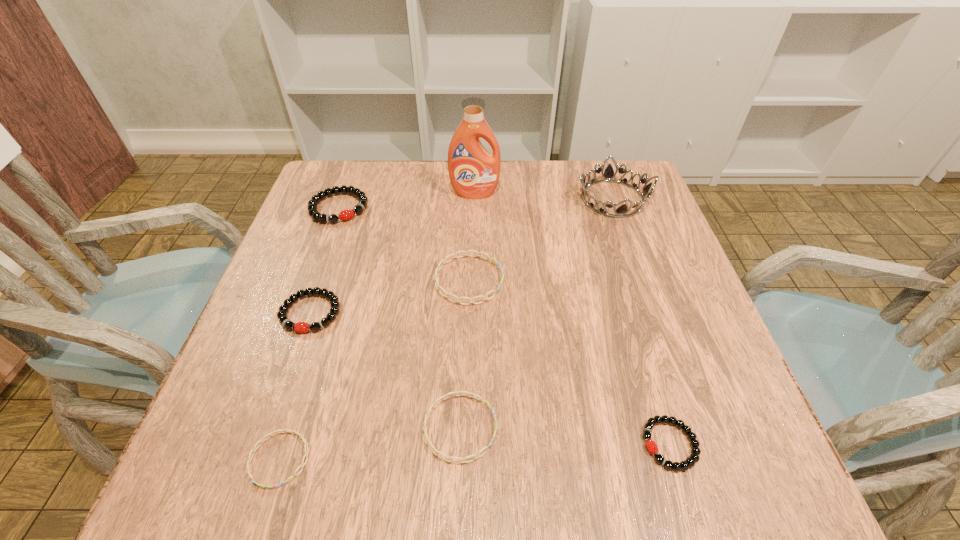
Identify the location of detergent located at the far edge. The image size is (960, 540). (474, 172).

Locate an element on the screen. This screenshot has height=540, width=960. tiara at the far edge is located at coordinates (621, 211).

Where is `bracelet situated at the far edge`? bracelet situated at the far edge is located at coordinates (348, 214).

The image size is (960, 540). I want to click on tiara positioned at the right edge, so 621,211.

The image size is (960, 540). Identify the location of bracelet that is positioned at the right edge. pyautogui.click(x=651, y=446).

Identify the location of object located at the far left corner. This screenshot has width=960, height=540. (348, 214).

Find the location of a particular element. The height and width of the screenshot is (540, 960). object that is at the near left corner is located at coordinates (301, 436).

This screenshot has width=960, height=540. I want to click on object that is at the far right corner, so click(x=621, y=211).

At what (x,y) coordinates should I click in order to perform the action: click on object that is at the near right corner. Please return your answer as a coordinate pair (x, y). This screenshot has width=960, height=540. Looking at the image, I should click on (651, 446).

Identify the location of free space at the far edge of the desktop. This screenshot has width=960, height=540. (537, 173).